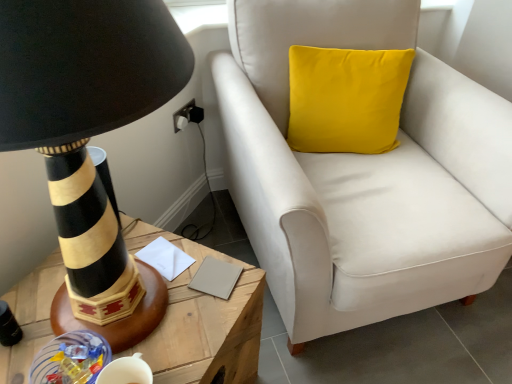
Question: From a real-world perspective, is velvet white armchair at upper right below beige matte notepad at center, the first notepad when ordered from right to left?

Choices:
 (A) no
 (B) yes

Answer: (B)

Question: Is beige matte notepad at center, the first notepad when ordered from right to left, at the back of velvet white armchair at upper right?

Choices:
 (A) yes
 (B) no

Answer: (B)

Question: From the image's perspective, would you say velvet white armchair at upper right is shown under beige matte notepad at center, the first notepad when ordered from right to left?

Choices:
 (A) no
 (B) yes

Answer: (A)

Question: Is beige matte notepad at center, which is the 2th notepad in left-to-right order, surrounded by velvet white armchair at upper right?

Choices:
 (A) yes
 (B) no

Answer: (B)

Question: Does velvet white armchair at upper right have a lesser width compared to beige matte notepad at center, which is the 2th notepad in left-to-right order?

Choices:
 (A) yes
 (B) no

Answer: (B)

Question: Does velvet white armchair at upper right have a larger size compared to beige matte notepad at center, the first notepad when ordered from right to left?

Choices:
 (A) no
 (B) yes

Answer: (B)

Question: Is wooden table at left not close to black striped lamp at left?

Choices:
 (A) yes
 (B) no

Answer: (B)

Question: Is wooden table at left oriented away from black striped lamp at left?

Choices:
 (A) yes
 (B) no

Answer: (B)

Question: Considering the relative sizes of wooden table at left and black striped lamp at left in the image provided, is wooden table at left wider than black striped lamp at left?

Choices:
 (A) yes
 (B) no

Answer: (A)

Question: From the image's perspective, would you say wooden table at left is positioned over black striped lamp at left?

Choices:
 (A) no
 (B) yes

Answer: (A)

Question: Can you confirm if wooden table at left is shorter than black striped lamp at left?

Choices:
 (A) no
 (B) yes

Answer: (B)

Question: Can you confirm if wooden table at left is taller than black striped lamp at left?

Choices:
 (A) no
 (B) yes

Answer: (A)

Question: From the image's perspective, does white paper at center, which is the 2th notepad in right-to-left order, appear higher than black striped lamp at left?

Choices:
 (A) no
 (B) yes

Answer: (A)